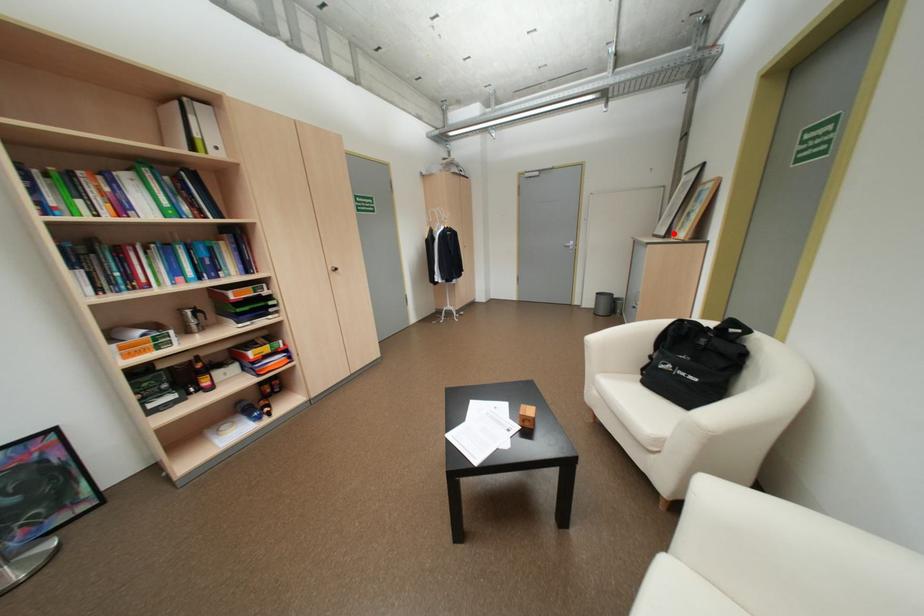
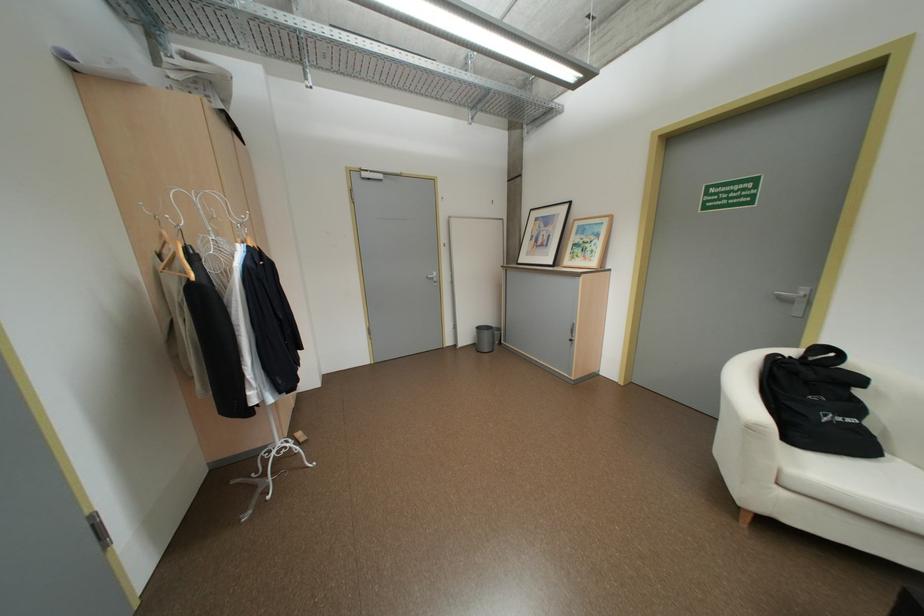
Question: I am providing you with two images of the same scene from different viewpoints. A red point is marked on the first image. Is the red point's position out of view in image 2?

Choices:
 (A) Yes
 (B) No

Answer: (B)